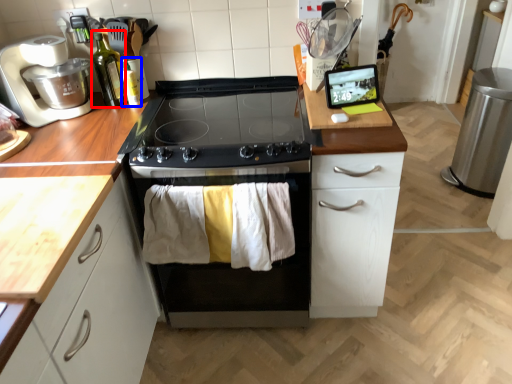
Question: Among these objects, which one is farthest to the camera, bottle (highlighted by a red box) or bottle (highlighted by a blue box)?

Choices:
 (A) bottle
 (B) bottle

Answer: (B)